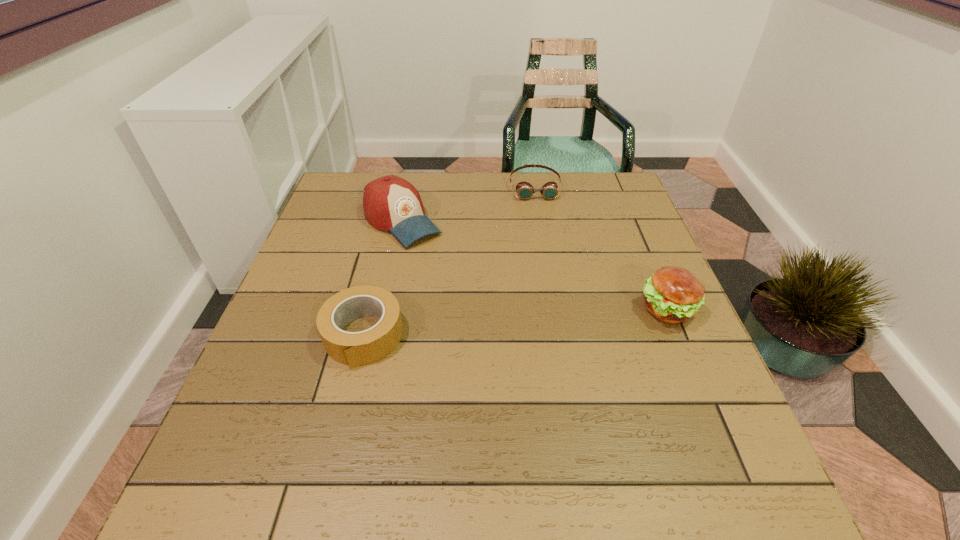
You are a GUI agent. You are given a task and a screenshot of the screen. Output one action in this format:
    pyautogui.click(x=<x>, y=<y>)
    Task: Click on the vacant region at the near edge of the desktop
    
    Given the screenshot: What is the action you would take?
    pyautogui.click(x=318, y=438)

Locate an element on the screen. vacant space at the left edge is located at coordinates (357, 227).

This screenshot has height=540, width=960. In order to click on vacant region at the right edge of the desktop in this screenshot , I will do `click(609, 306)`.

Identify the location of free space at the far left corner. The width and height of the screenshot is (960, 540). (353, 187).

Where is `vacant region between the hamburger and the second shortest object`? This screenshot has width=960, height=540. vacant region between the hamburger and the second shortest object is located at coordinates (516, 323).

The image size is (960, 540). In order to click on vacant space that's between the baseball cap and the shortest object in this screenshot , I will do `click(468, 204)`.

The width and height of the screenshot is (960, 540). What are the coordinates of `vacant region between the goggles and the baseball cap` in the screenshot? It's located at 468,204.

You are a GUI agent. You are given a task and a screenshot of the screen. Output one action in this format:
    pyautogui.click(x=<x>, y=<y>)
    Task: Click on the vacant space that is in between the second shortest object and the baseball cap
    This screenshot has height=540, width=960.
    Given the screenshot: What is the action you would take?
    pyautogui.click(x=382, y=279)

This screenshot has height=540, width=960. Find the location of `vacant space that is in between the baseball cap and the shortest object`. vacant space that is in between the baseball cap and the shortest object is located at coordinates (468, 204).

Identify the location of free space between the baseball cap and the hamburger. The image size is (960, 540). (535, 266).